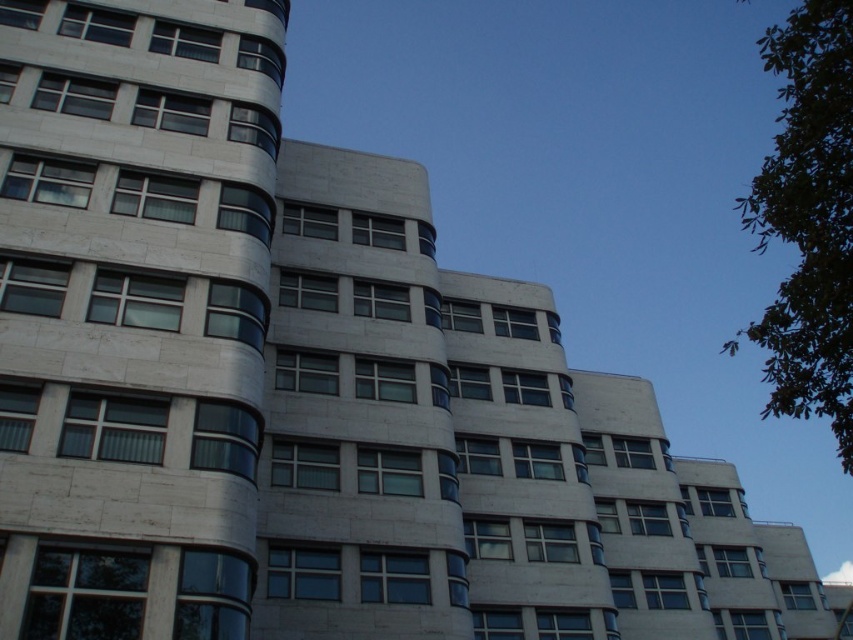
Is point (97, 428) positioned in front of point (809, 269)?

That is False.

From the picture: Can you confirm if white marble building at center is wider than green leafy tree at upper right?

Incorrect, white marble building at center's width does not surpass green leafy tree at upper right's.

Which is behind, point (160, 22) or point (845, 93)?

Positioned behind is point (160, 22).

Locate an element on the screen. white marble building at center is located at coordinates (132, 310).